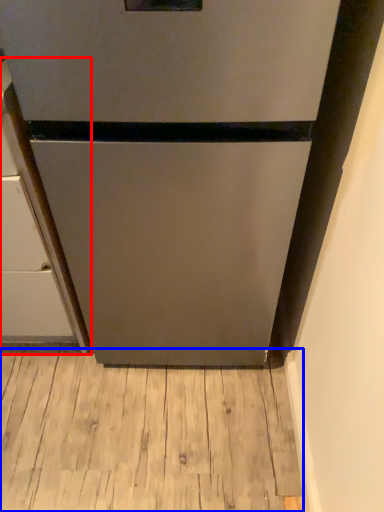
Question: Among these objects, which one is farthest to the camera, cabinetry (highlighted by a red box) or hardwood (highlighted by a blue box)?

Choices:
 (A) cabinetry
 (B) hardwood

Answer: (B)